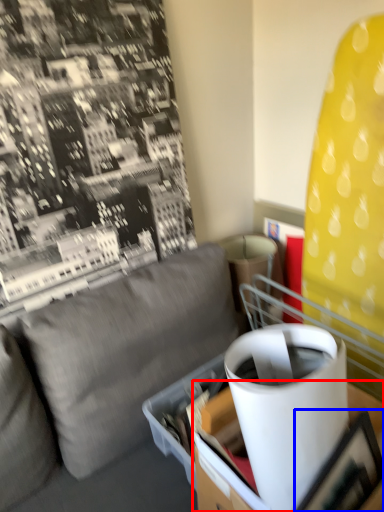
Question: Which object appears farthest to the camera in this image, table (highlighted by a red box) or picture frame (highlighted by a blue box)?

Choices:
 (A) table
 (B) picture frame

Answer: (B)